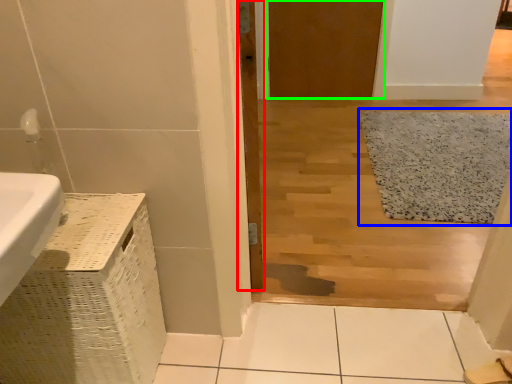
Question: Estimate the real-world distances between objects in this image. Which object is farther from door (highlighted by a red box), bath mat (highlighted by a blue box) or door (highlighted by a green box)?

Choices:
 (A) bath mat
 (B) door

Answer: (A)